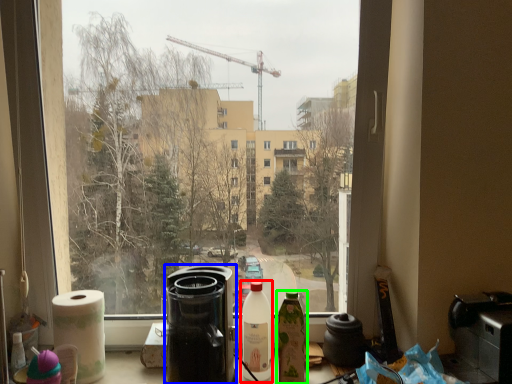
Question: Based on their relative distances, which object is nearer to bottle (highlighted by a red box)? Choose from appliance (highlighted by a blue box) and bottle (highlighted by a green box).

Choices:
 (A) appliance
 (B) bottle

Answer: (B)